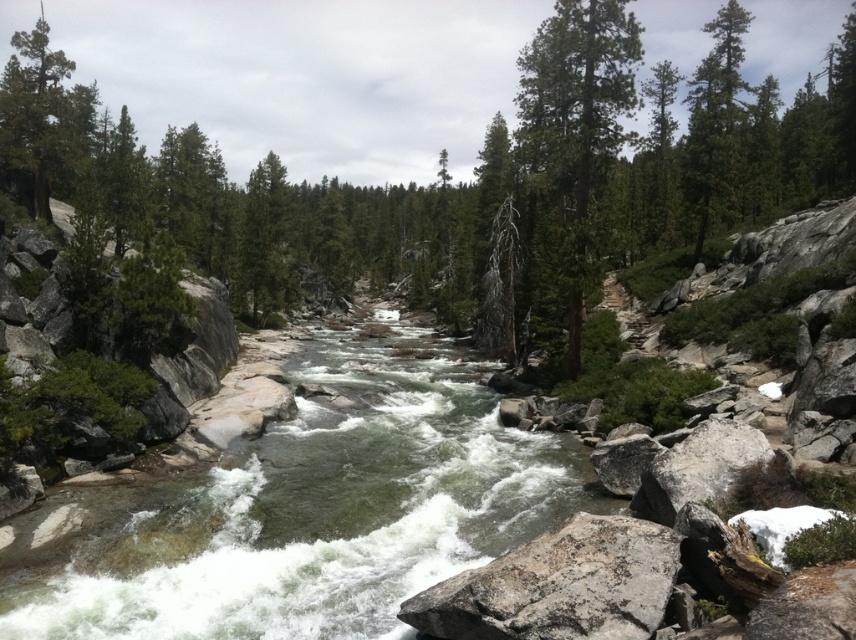
You are a hiker standing at the edge of the river and you see the green textured tree at center and the gray rough rock at center. Which object is closer to you?

The green textured tree at center is closer to you because the gray rough rock at center is behind it.

You are a hiker standing at the edge of the river and see the green textured tree at center and the gray rough rock at center. Which object is taller?

The green textured tree at center is taller than the gray rough rock at center.